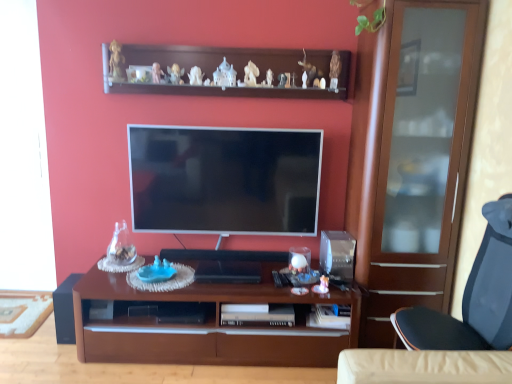
The image size is (512, 384). Identify the location of free space that is to the left of black matte speaker at lower left. (35, 336).